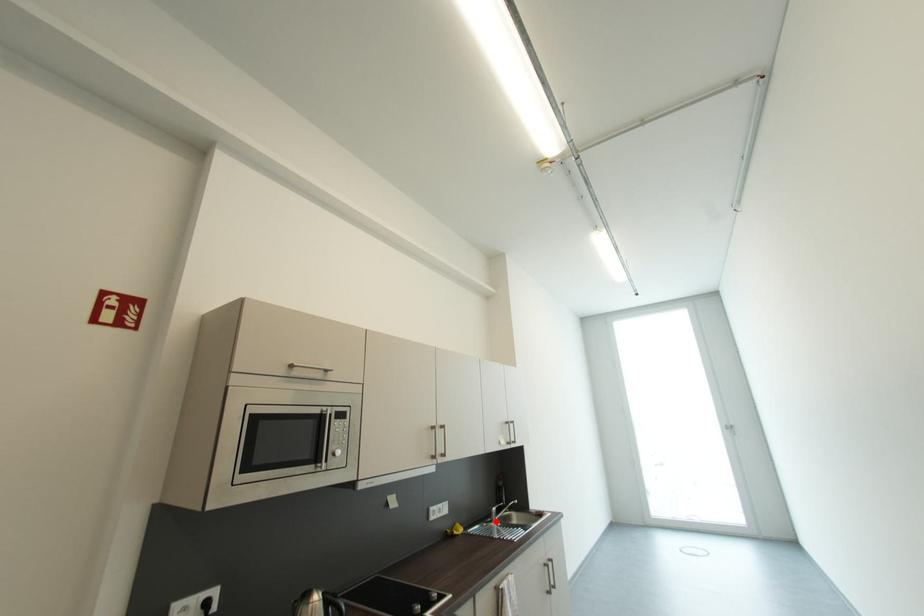
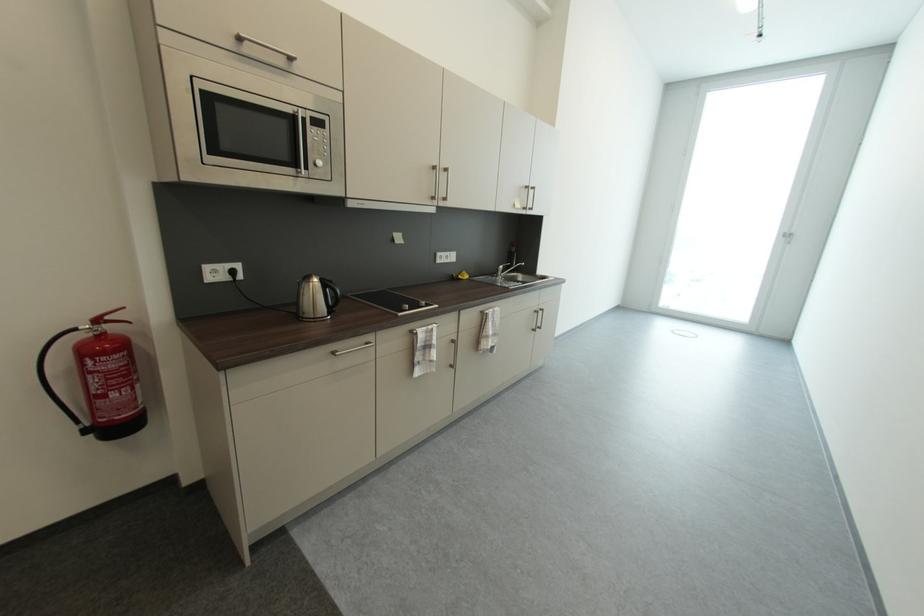
Question: A red point is marked in image1. In image2, is the corresponding 3D point closer to the camera or farther? Reply with the corresponding letter.

Choices:
 (A) The corresponding 3D point is closer.
 (B) The corresponding 3D point is farther.

Answer: (A)